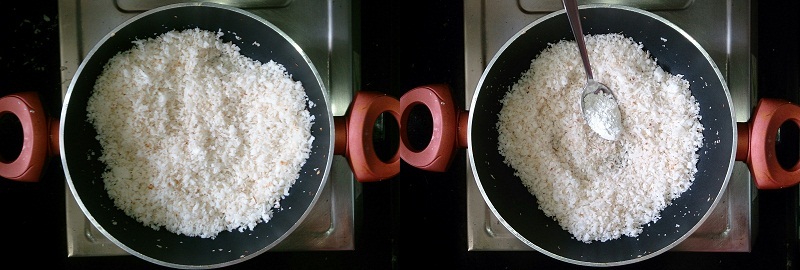
What are the coordinates of `spoon handle` in the screenshot? It's located at (577, 22).